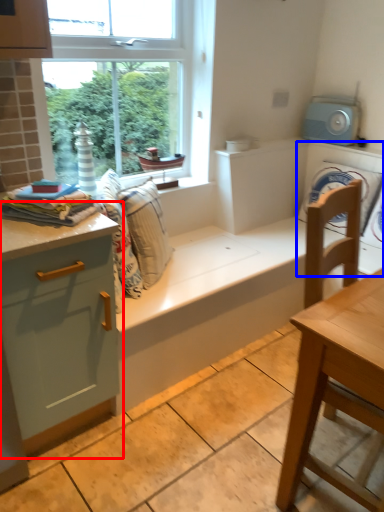
Question: Which object appears farthest to the camera in this image, dresser (highlighted by a red box) or washing machine (highlighted by a blue box)?

Choices:
 (A) dresser
 (B) washing machine

Answer: (B)